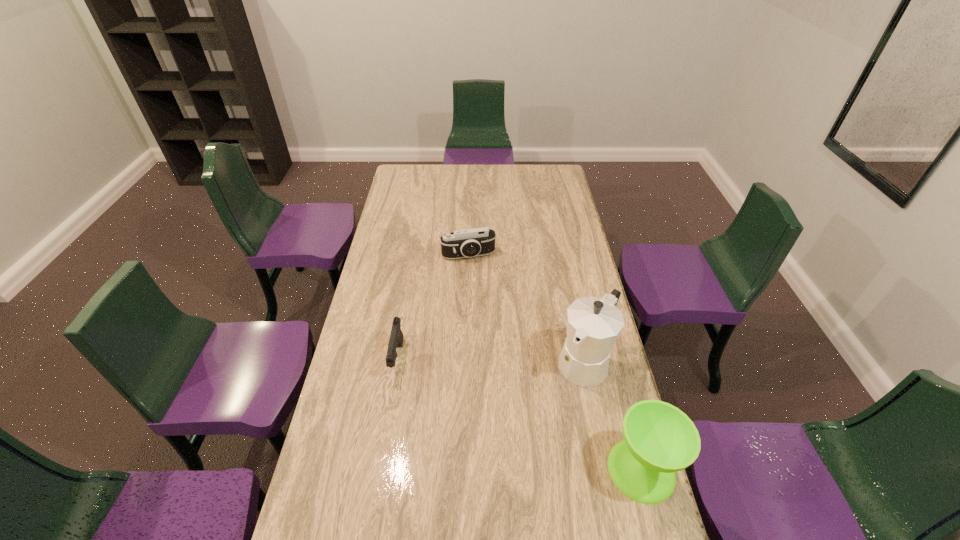
Image resolution: width=960 pixels, height=540 pixels. In order to click on the leftmost object in this screenshot , I will do `click(396, 337)`.

Locate an element on the screen. The width and height of the screenshot is (960, 540). the third shortest object is located at coordinates (659, 439).

Locate an element on the screen. The width and height of the screenshot is (960, 540). wineglass is located at coordinates (659, 439).

The height and width of the screenshot is (540, 960). I want to click on the tallest object, so click(593, 324).

You are a GUI agent. You are given a task and a screenshot of the screen. Output one action in this format:
    pyautogui.click(x=<x>, y=<y>)
    Task: Click on the third object from right to left
    This screenshot has width=960, height=540.
    Given the screenshot: What is the action you would take?
    (465, 243)

Where is `camera`? camera is located at coordinates (465, 243).

The height and width of the screenshot is (540, 960). Identify the location of blank area located 0.120m at the barrel of the pistol. 388,415.

Locate an element on the screen. vacant space situated on the left of the second tallest object is located at coordinates (485, 470).

This screenshot has height=540, width=960. In order to click on vacant space located 0.270m at the spout of the tallest object in this screenshot , I will do `click(524, 447)`.

I want to click on free space located at the spout of the tallest object, so click(x=542, y=422).